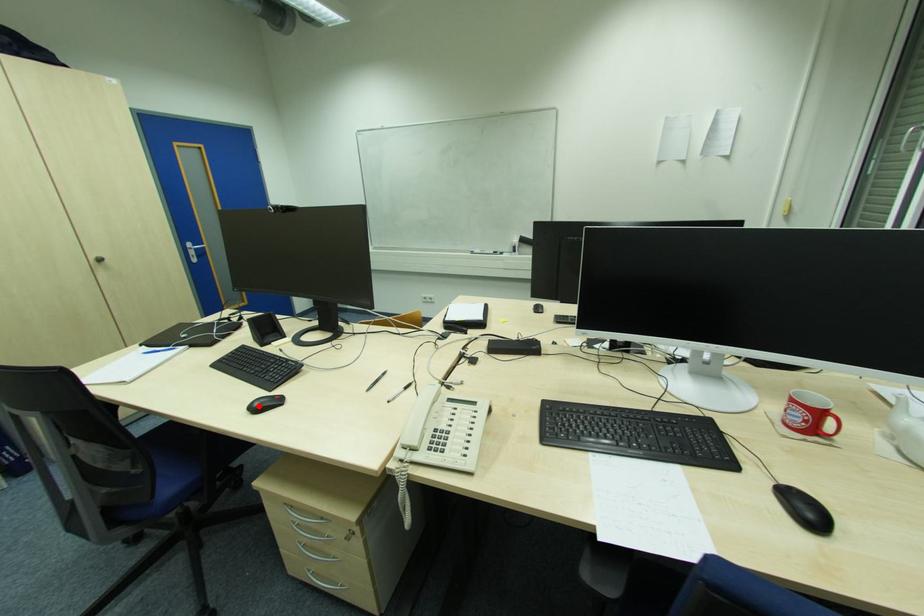
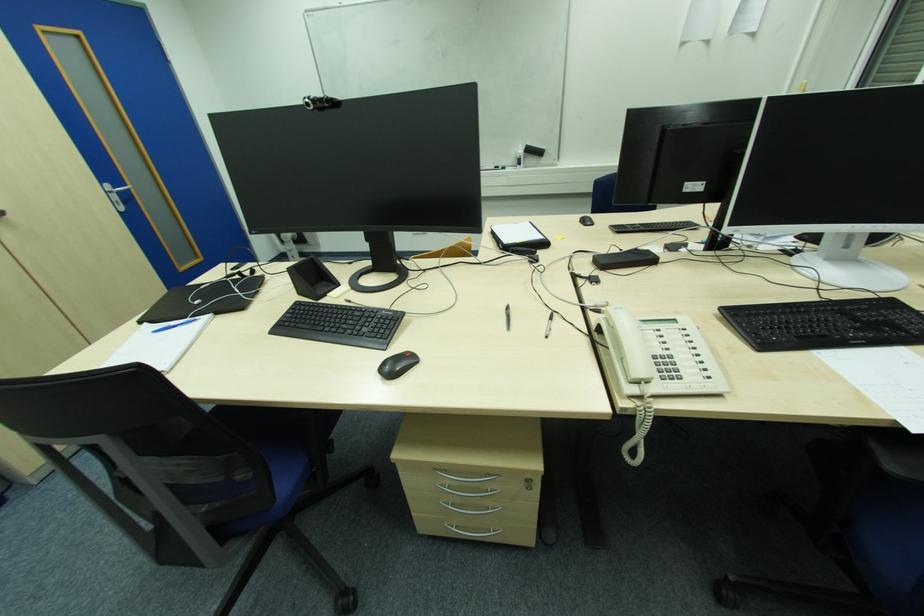
In the second image, find the point that corresponds to the highlighted location in the first image.

(388, 369)